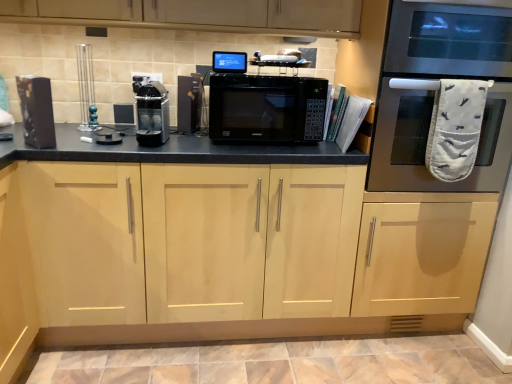
Question: From a real-world perspective, is light wood cabinet at center physically below stainless steel oven at right?

Choices:
 (A) yes
 (B) no

Answer: (A)

Question: Is light wood cabinet at center at the right side of stainless steel oven at right?

Choices:
 (A) no
 (B) yes

Answer: (A)

Question: Would you say light wood cabinet at center is a long distance from stainless steel oven at right?

Choices:
 (A) no
 (B) yes

Answer: (A)

Question: Is light wood cabinet at center touching stainless steel oven at right?

Choices:
 (A) yes
 (B) no

Answer: (B)

Question: From the image's perspective, is light wood cabinet at center over stainless steel oven at right?

Choices:
 (A) yes
 (B) no

Answer: (B)

Question: Is light wood cabinet at center facing towards stainless steel oven at right?

Choices:
 (A) no
 (B) yes

Answer: (A)

Question: Does black matte microwave at center have a larger size compared to black plastic toaster at center, which is the 3th appliance in left-to-right order?

Choices:
 (A) yes
 (B) no

Answer: (A)

Question: Does black matte microwave at center have a lesser width compared to black plastic toaster at center, acting as the 1th appliance starting from the right?

Choices:
 (A) yes
 (B) no

Answer: (B)

Question: Is the position of black matte microwave at center more distant than that of black plastic toaster at center, acting as the 1th appliance starting from the right?

Choices:
 (A) no
 (B) yes

Answer: (A)

Question: From a real-world perspective, is black matte microwave at center under black plastic toaster at center, acting as the 1th appliance starting from the right?

Choices:
 (A) yes
 (B) no

Answer: (A)

Question: Is black matte microwave at center to the left of black plastic toaster at center, acting as the 1th appliance starting from the right, from the viewer's perspective?

Choices:
 (A) no
 (B) yes

Answer: (A)

Question: Can you confirm if black matte microwave at center is shorter than black plastic toaster at center, acting as the 1th appliance starting from the right?

Choices:
 (A) no
 (B) yes

Answer: (B)

Question: Are black plastic toaster at center, which is the 3th appliance in left-to-right order, and stainless steel oven at right located far from each other?

Choices:
 (A) yes
 (B) no

Answer: (A)